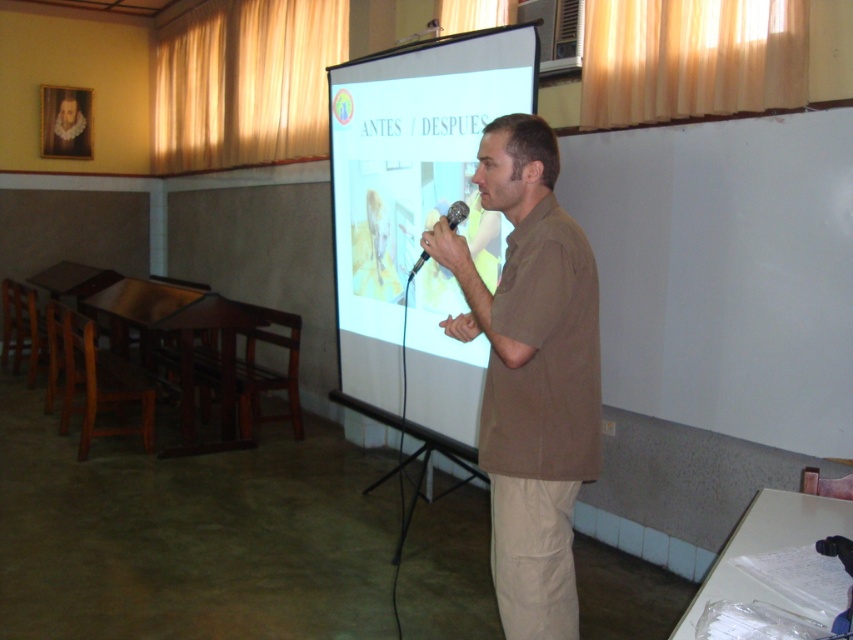
Question: Is brown cotton shirt at center below black plastic microphone at center?

Choices:
 (A) no
 (B) yes

Answer: (B)

Question: Can you confirm if white matte projection screen at center is bigger than black plastic microphone at center?

Choices:
 (A) no
 (B) yes

Answer: (B)

Question: Is brown cotton shirt at center below black plastic microphone at center?

Choices:
 (A) no
 (B) yes

Answer: (B)

Question: Which object is farther from the camera taking this photo?

Choices:
 (A) black plastic microphone at center
 (B) brown cotton shirt at center

Answer: (A)

Question: Among these points, which one is nearest to the camera?

Choices:
 (A) (351, 118)
 (B) (503, 566)
 (C) (447, 221)

Answer: (B)

Question: Which object is the closest to the brown cotton shirt at center?

Choices:
 (A) black plastic microphone at center
 (B) white matte projection screen at center

Answer: (A)